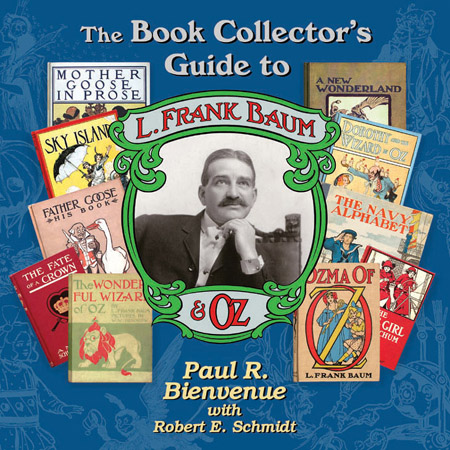
The height and width of the screenshot is (450, 450). Find the location of `coat`. coat is located at coordinates (173, 248).